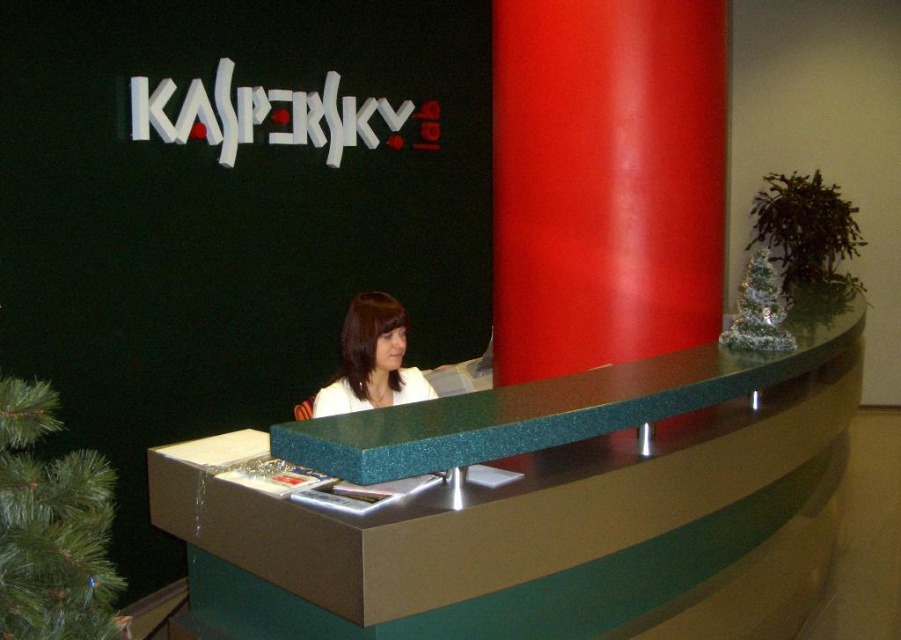
Measure the distance between green speckled laminate desk at center and white matte jacket at center.

32.63 inches

Is point (854, 364) more distant than point (383, 336)?

Yes, point (854, 364) is farther from viewer.

Identify the location of green speckled laminate desk at center. The image size is (901, 640). (537, 506).

Is green speckled laminate desk at center taller than red glossy pillar at center?

No.

Who is more forward, (727, 618) or (666, 67)?

Point (727, 618)

Is point (811, 426) in front of point (588, 112)?

Yes, it is in front of point (588, 112).

At what (x,y) coordinates should I click in order to perform the action: click on green speckled laminate desk at center. Please return your answer as a coordinate pair (x, y). Looking at the image, I should click on (537, 506).

Does point (683, 301) come in front of point (402, 368)?

Yes.

How distant is red glossy pillar at center from white matte jacket at center?

red glossy pillar at center and white matte jacket at center are 36.47 inches apart from each other.

Locate an element on the screen. The height and width of the screenshot is (640, 901). red glossy pillar at center is located at coordinates (606, 180).

In order to click on red glossy pillar at center in this screenshot , I will do [x=606, y=180].